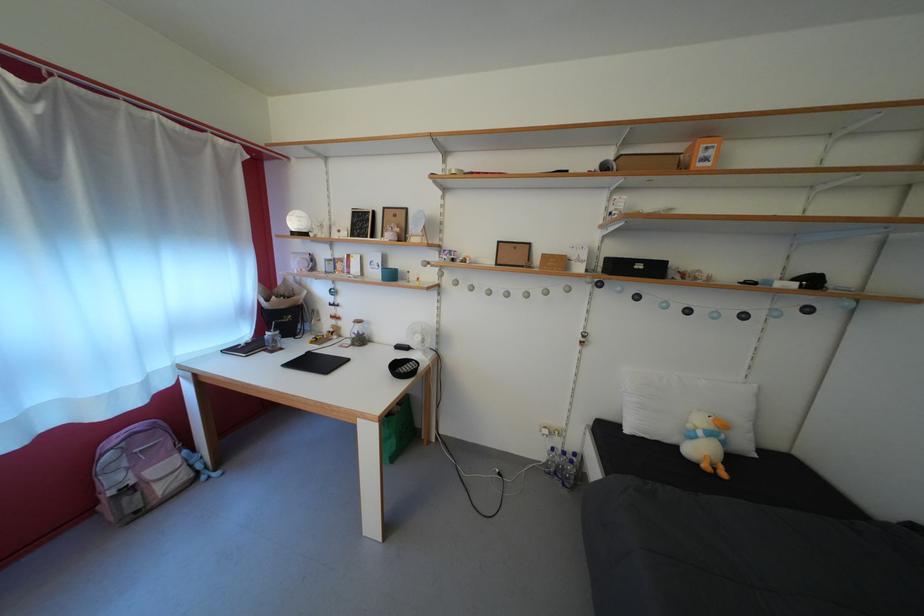
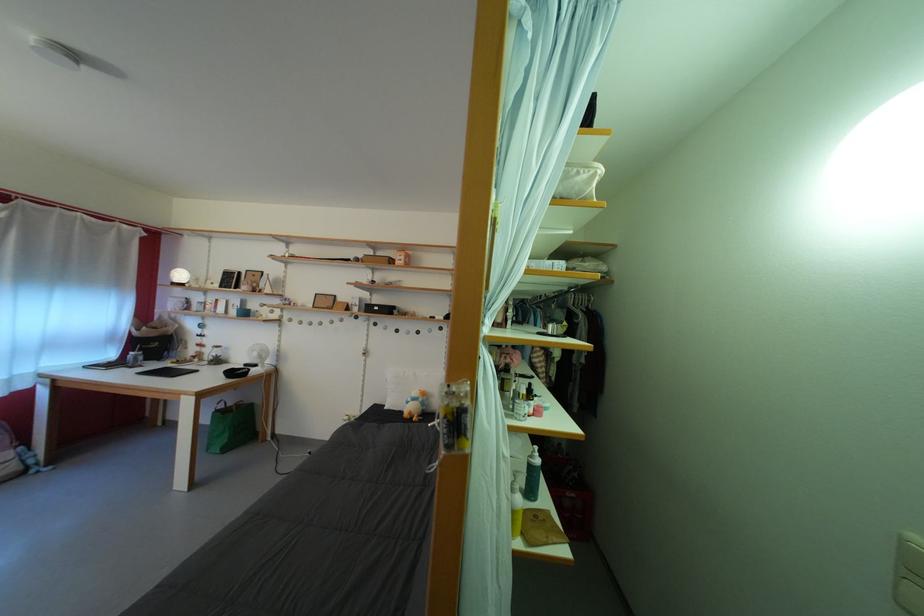
Locate, in the second image, the point that corresponds to pixel 709 439 in the first image.

(418, 405)